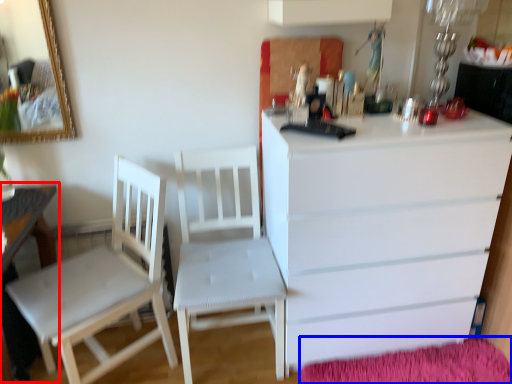
Question: Which of the following is the farthest to the observer, table (highlighted by a red box) or mat (highlighted by a blue box)?

Choices:
 (A) table
 (B) mat

Answer: (B)